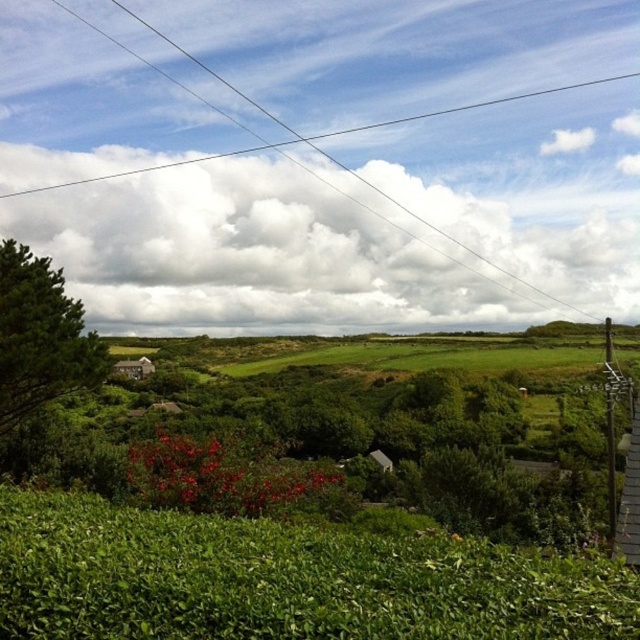
Question: Which point is farther from the camera taking this photo?

Choices:
 (A) (3, 371)
 (B) (392, 188)

Answer: (B)

Question: Is clear wire at upper center below green leafy tree at left?

Choices:
 (A) yes
 (B) no

Answer: (B)

Question: Does clear wire at upper center appear on the left side of green leafy tree at left?

Choices:
 (A) no
 (B) yes

Answer: (A)

Question: In this image, where is clear wire at upper center located relative to green leafy tree at left?

Choices:
 (A) left
 (B) right

Answer: (B)

Question: Which point is farther to the camera?

Choices:
 (A) clear wire at upper center
 (B) green leafy tree at left

Answer: (A)

Question: Which of the following is the farthest from the observer?

Choices:
 (A) (384, 241)
 (B) (10, 461)

Answer: (A)